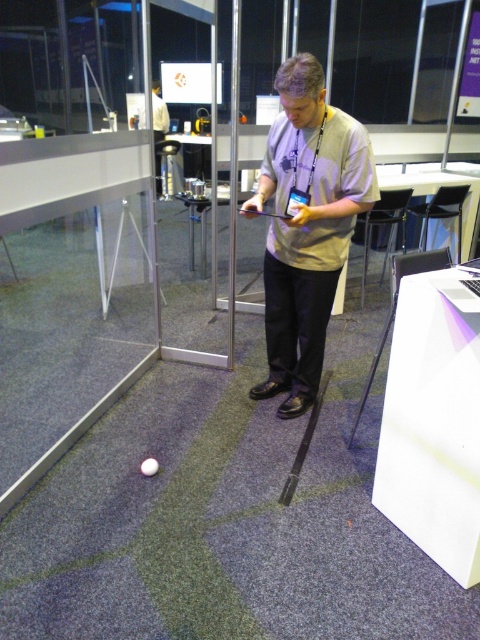
You are a security guard in the conference hall. You need to check the distance between the light gray cotton shirt at center and the transparent glass door at center. Can you confirm if the distance is more than 50 centimeters?

The light gray cotton shirt at center is 59.32 centimeters from the transparent glass door at center, so yes, the distance is more than 50 centimeters.

You are an event organizer checking the layout of the conference room. You see the light gray cotton shirt at center and the white matte ball at lower center. Which object is wider?

The light gray cotton shirt at center is wider than the white matte ball at lower center.

You are standing in the conference room and want to pick up the white matte ball at lower center. Which direction should you move relative to the transparent glass door at center?

The transparent glass door at center is to the right of the white matte ball at lower center, so you should move to the left relative to the transparent glass door at center to reach the white matte ball at lower center.